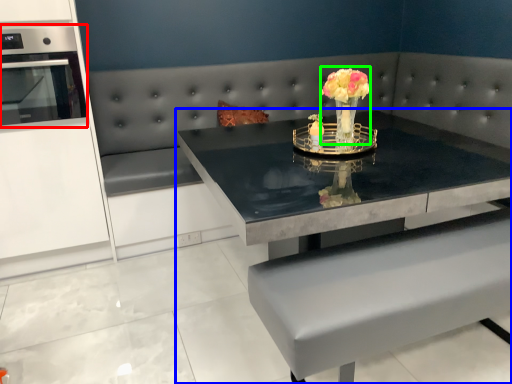
Question: Based on their relative distances, which object is nearer to appliance (highlighted by a red box)? Choose from table (highlighted by a blue box) and floral arrangement (highlighted by a green box).

Choices:
 (A) table
 (B) floral arrangement

Answer: (A)